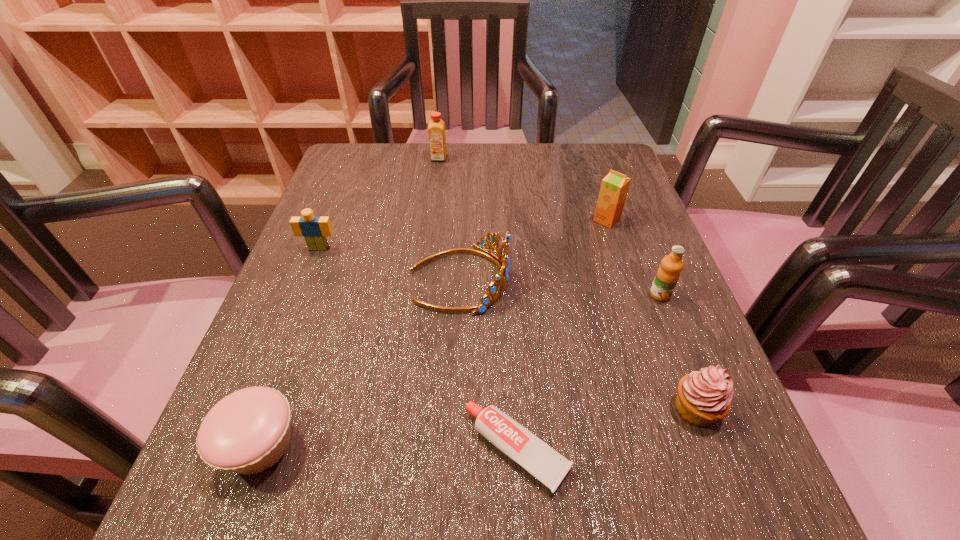
You are a GUI agent. You are given a task and a screenshot of the screen. Output one action in this format:
    pyautogui.click(x=<x>, y=<y>)
    Task: Click on the vacant region at the far left corner
    
    Given the screenshot: What is the action you would take?
    pyautogui.click(x=365, y=180)

Where is `free region at the near left corner of the desktop`? This screenshot has width=960, height=540. free region at the near left corner of the desktop is located at coordinates (206, 500).

This screenshot has width=960, height=540. Identify the location of vacant space at the far right corner of the desktop. click(x=564, y=177).

In the image, there is a desktop. Where is `blank space at the near right corner`? This screenshot has height=540, width=960. blank space at the near right corner is located at coordinates (651, 490).

Locate an element on the screen. Image resolution: width=960 pixels, height=540 pixels. free space between the shorter cupcake and the Lego is located at coordinates (289, 346).

Where is `blank region between the taller cupcake and the shortest object`? The width and height of the screenshot is (960, 540). blank region between the taller cupcake and the shortest object is located at coordinates (606, 429).

Locate an element on the screen. Image resolution: width=960 pixels, height=540 pixels. free space between the tiara and the farthest object is located at coordinates (449, 219).

The height and width of the screenshot is (540, 960). Find the location of `empty space that is in between the nearest orange juice and the toothpaste`. empty space that is in between the nearest orange juice and the toothpaste is located at coordinates click(x=588, y=372).

Locate an element on the screen. vacant area between the second shortest object and the second farthest orange juice is located at coordinates 433,332.

Identify the location of empty location between the tiara and the left cupcake. The image size is (960, 540). (359, 362).